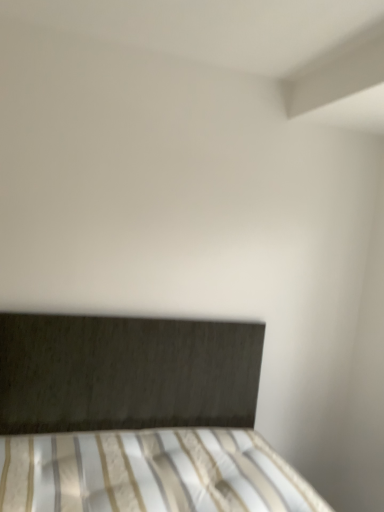
This screenshot has width=384, height=512. I want to click on dark wood bed at center, so click(136, 418).

What do you see at coordinates (136, 418) in the screenshot? This screenshot has width=384, height=512. I see `dark wood bed at center` at bounding box center [136, 418].

The width and height of the screenshot is (384, 512). I want to click on dark wood bed at center, so click(136, 418).